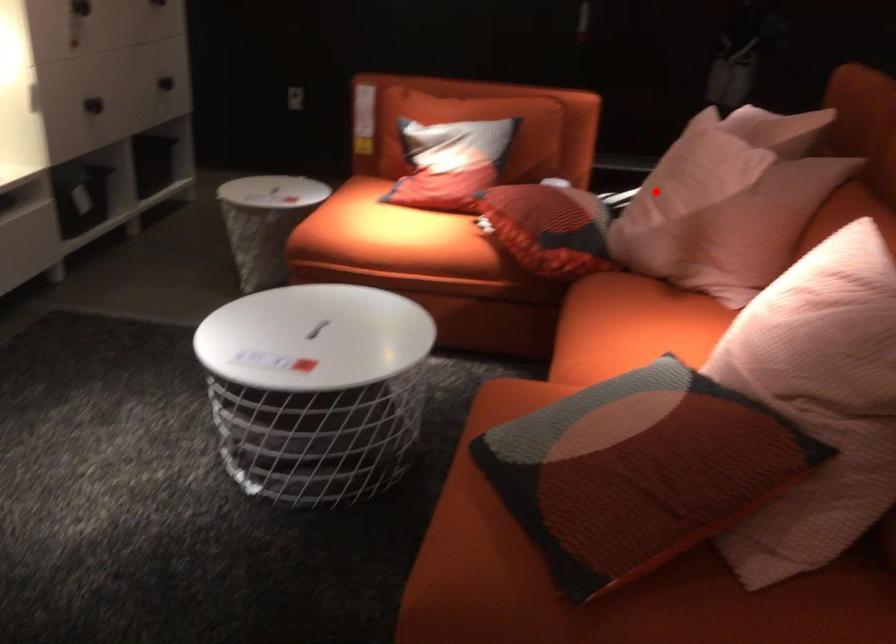
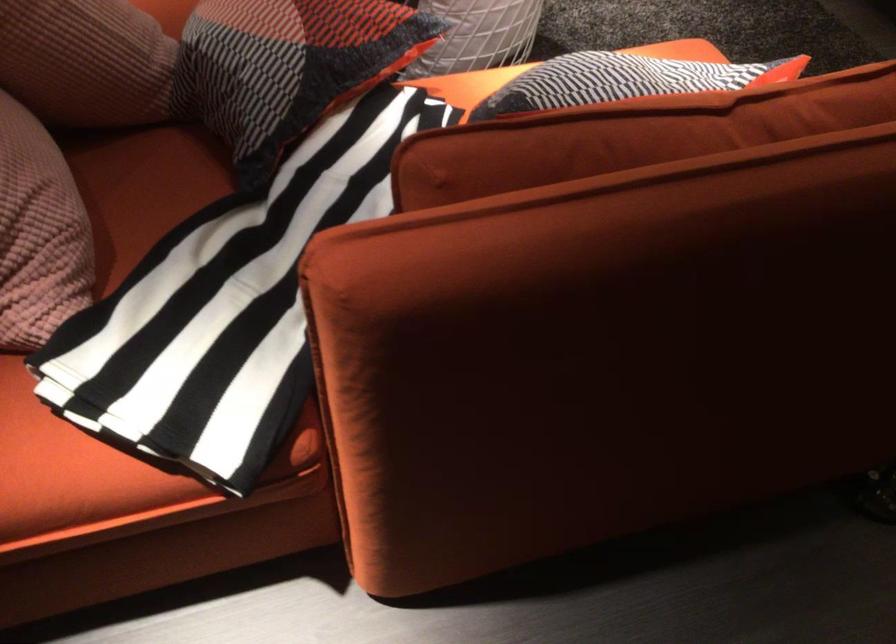
Question: I am providing you with two images of the same scene from different viewpoints. A red point is shown in image1. For the corresponding object point in image2, is it positioned nearer or farther from the camera?

Choices:
 (A) Nearer
 (B) Farther

Answer: (A)